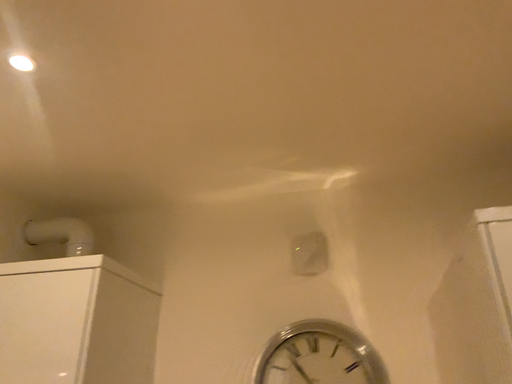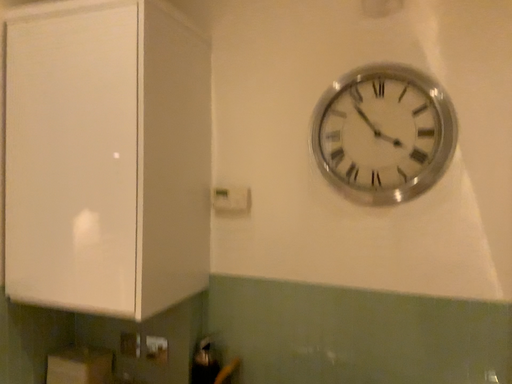
Question: How did the camera likely rotate when shooting the video?

Choices:
 (A) rotated upward
 (B) rotated downward

Answer: (B)